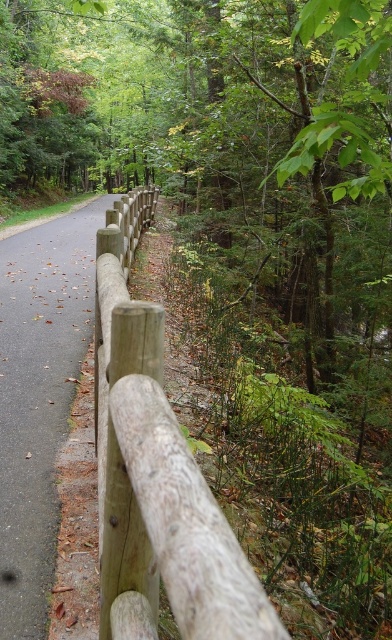
What do you see at coordinates (157, 488) in the screenshot? Image resolution: width=392 pixels, height=640 pixels. I see `wooden fence at center` at bounding box center [157, 488].

In order to click on wooden fence at center in this screenshot , I will do `click(157, 488)`.

Locate an element on the screen. The image size is (392, 640). wooden fence at center is located at coordinates (157, 488).